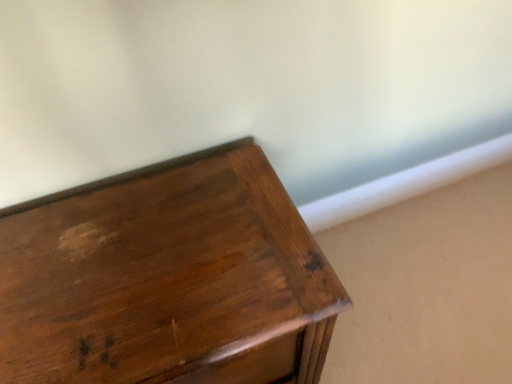
The image size is (512, 384). What are the coordinates of `glossy wood drawer at center` in the screenshot? It's located at (167, 279).

This screenshot has height=384, width=512. What do you see at coordinates (167, 279) in the screenshot?
I see `glossy wood drawer at center` at bounding box center [167, 279].

Locate an element on the screen. Image resolution: width=512 pixels, height=384 pixels. glossy wood drawer at center is located at coordinates (167, 279).